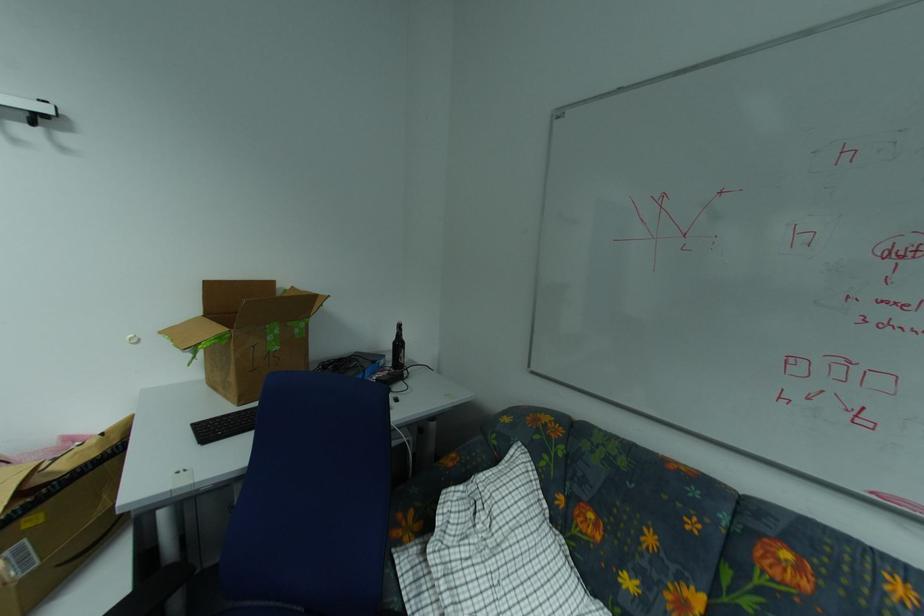
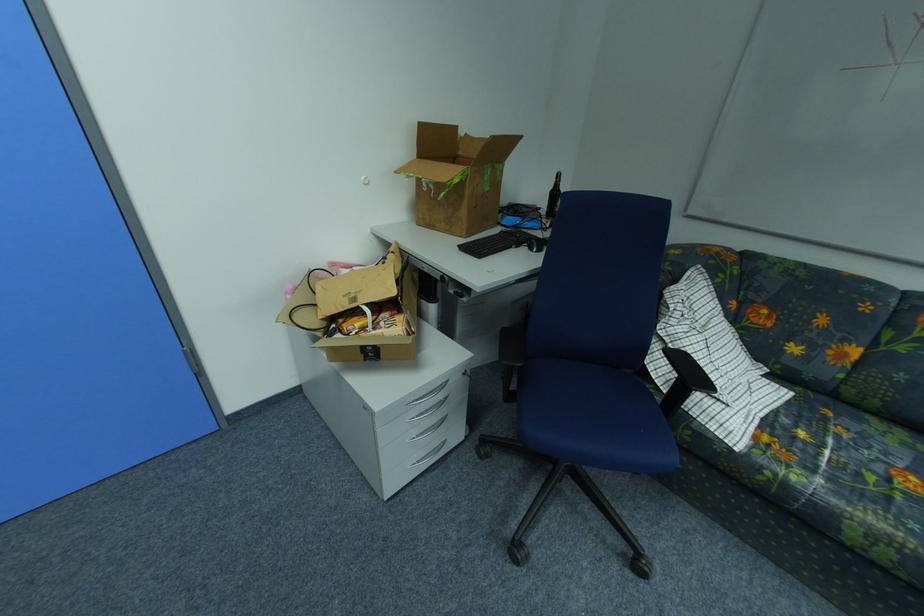
Where in the second image is the point corresponding to (403,339) from the first image?

(560, 188)